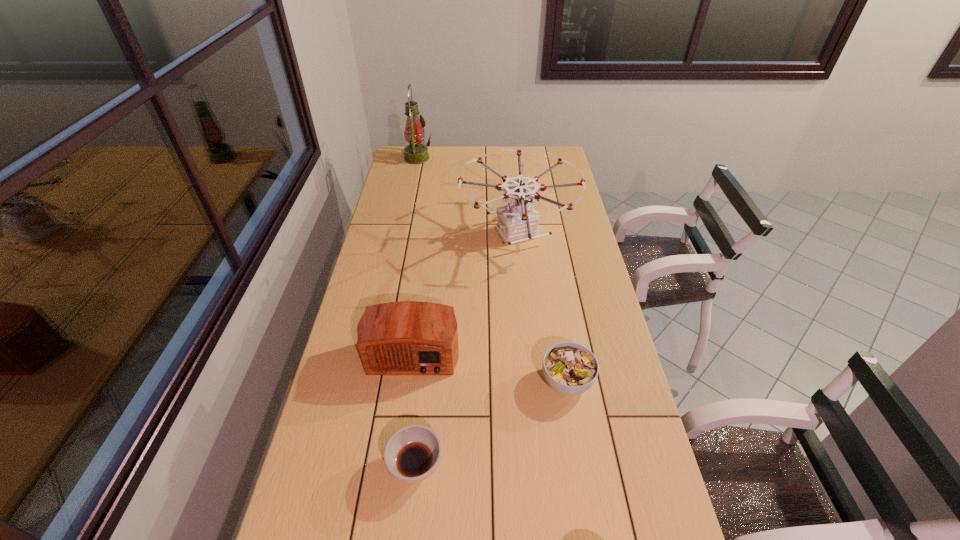
Find the location of a particular element. the farthest object is located at coordinates (415, 153).

I want to click on the fourth nearest object, so point(517,222).

Find the location of a particular element. the third shortest object is located at coordinates (408, 337).

Where is `the farther soup bowl`? the farther soup bowl is located at coordinates (569, 368).

The width and height of the screenshot is (960, 540). Identify the location of the nearer soup bowl. (413, 453).

This screenshot has width=960, height=540. What are the coordinates of `the left soup bowl` in the screenshot? It's located at (413, 453).

Locate an element on the screen. Image resolution: width=960 pixels, height=540 pixels. free space located on the right of the farthest object is located at coordinates 467,158.

I want to click on free location located 0.250m on the back of the drone, so [512, 174].

The height and width of the screenshot is (540, 960). Identify the location of vacant point located 0.090m on the front-facing side of the third shortest object. (405, 409).

This screenshot has height=540, width=960. In order to click on vacant region located on the back of the right soup bowl in this screenshot , I will do `click(550, 281)`.